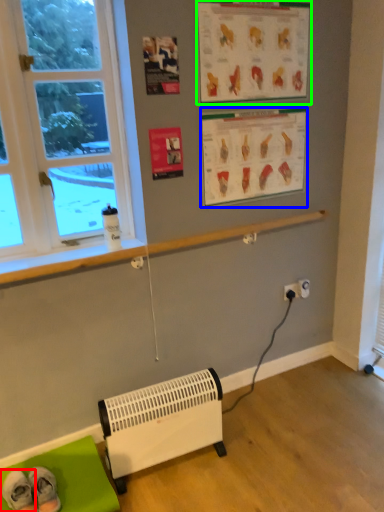
Question: Estimate the real-world distances between objects in this image. Which object is farther from footwear (highlighted by a red box), writing (highlighted by a blue box) or writing (highlighted by a green box)?

Choices:
 (A) writing
 (B) writing

Answer: (B)